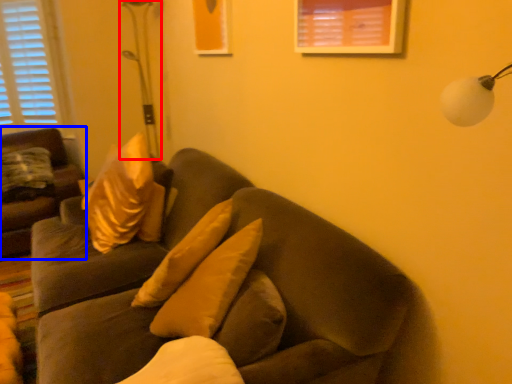
Question: Which of the following is the farthest to the observer, table lamp (highlighted by a red box) or studio couch (highlighted by a blue box)?

Choices:
 (A) table lamp
 (B) studio couch

Answer: (A)